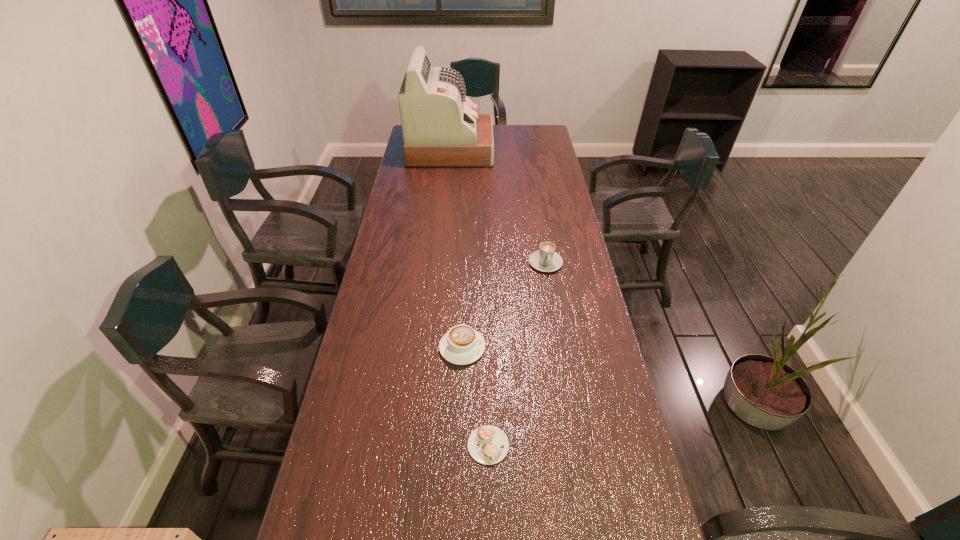
You are a GUI agent. You are given a task and a screenshot of the screen. Output one action in this format:
    pyautogui.click(x=<x>, y=<y>)
    Task: Click on the free space between the farthest object and the nearest cappuccino
    This screenshot has width=960, height=540.
    Given the screenshot: What is the action you would take?
    pyautogui.click(x=469, y=298)

You are a GUI agent. You are given a task and a screenshot of the screen. Output one action in this format:
    pyautogui.click(x=<x>, y=<y>)
    Task: Click on the free spot between the second farthest cappuccino and the farthest object
    The width and height of the screenshot is (960, 540).
    Given the screenshot: What is the action you would take?
    pyautogui.click(x=456, y=249)

The height and width of the screenshot is (540, 960). In order to click on free space between the farthest cappuccino and the third tallest object in this screenshot , I will do [x=504, y=305].

This screenshot has width=960, height=540. Identify the location of vacant region between the second tallest cappuccino and the nearest object. (475, 396).

The width and height of the screenshot is (960, 540). Find the location of `vacant space that's between the nearest object and the rightmost object`. vacant space that's between the nearest object and the rightmost object is located at coordinates (516, 354).

At what (x,y) coordinates should I click in order to perform the action: click on vacant space that is in between the tallest cappuccino and the second shortest object. Please return your answer as a coordinate pair (x, y). The height and width of the screenshot is (540, 960). Looking at the image, I should click on (504, 305).

The image size is (960, 540). In order to click on free space between the farthest object and the second nearest cappuccino in this screenshot , I will do `click(456, 249)`.

Find the location of a particular element. The width and height of the screenshot is (960, 540). vacant area that lies between the nearest object and the farthest object is located at coordinates (469, 298).

I want to click on the second closest object to the second tallest object, so click(x=487, y=444).

Identify the location of object that is the second closest to the nearest object. The image size is (960, 540). [546, 259].